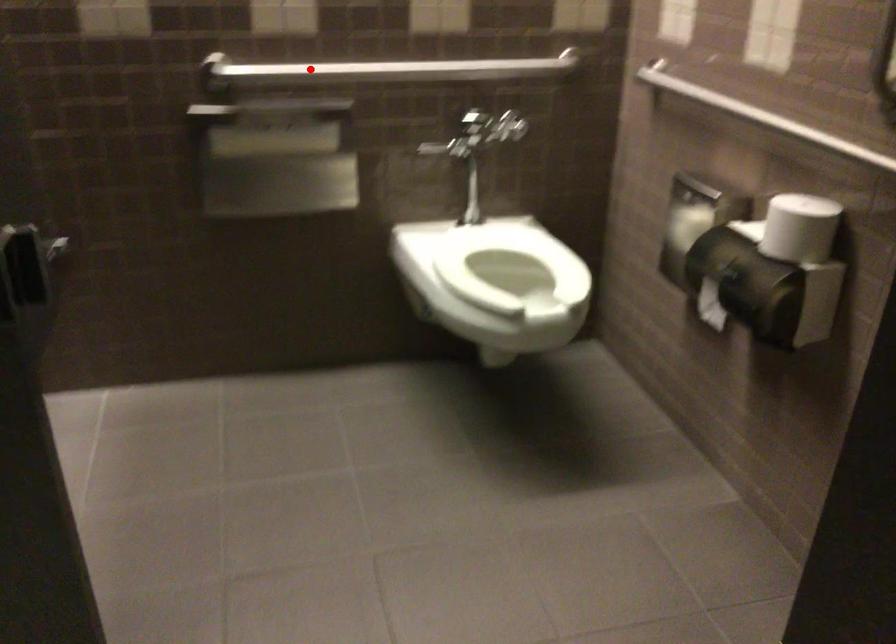
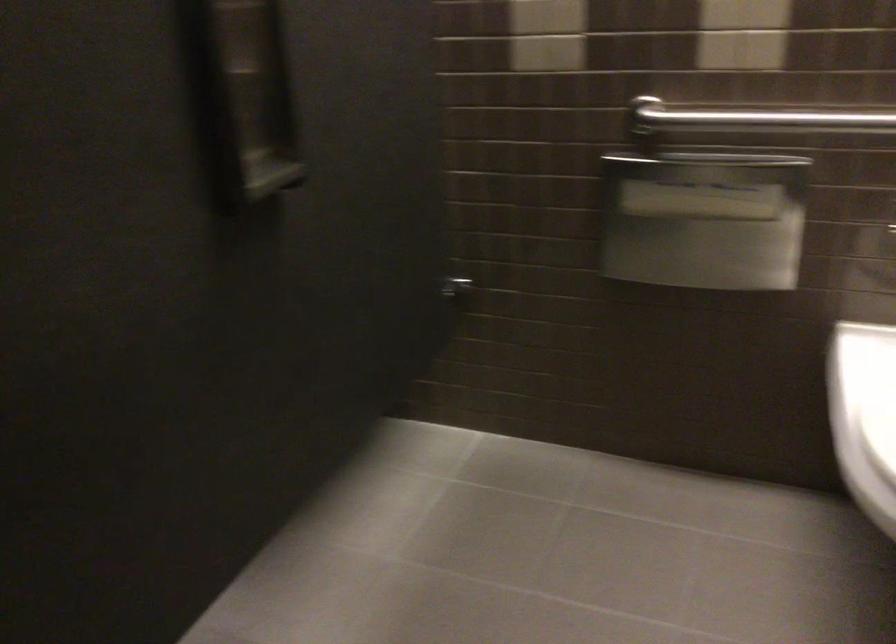
Question: I am providing you with two images of the same scene from different viewpoints. Image1 has a red point marked. In image2, the corresponding 3D location appears at what relative position? Reply with the corresponding letter.

Choices:
 (A) Closer
 (B) Farther

Answer: (A)